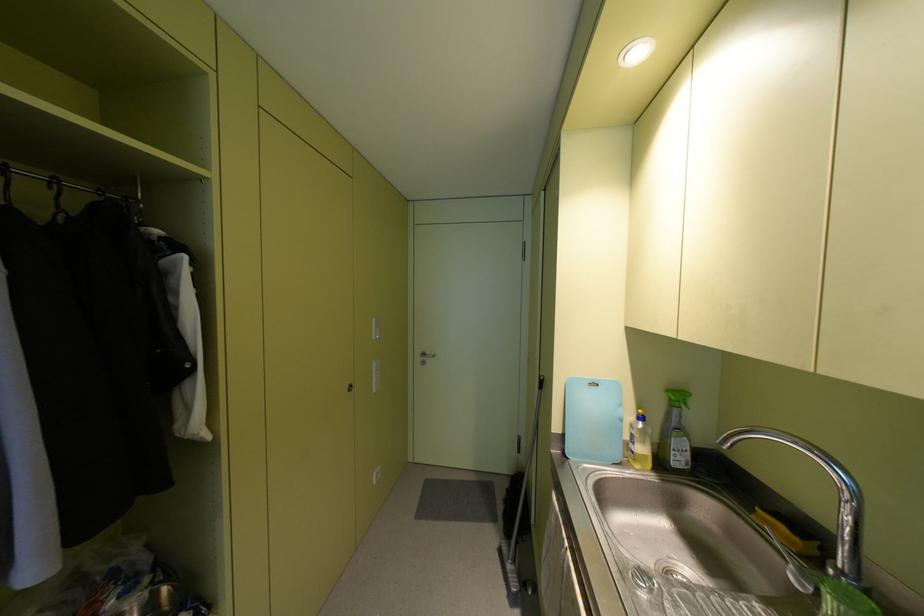
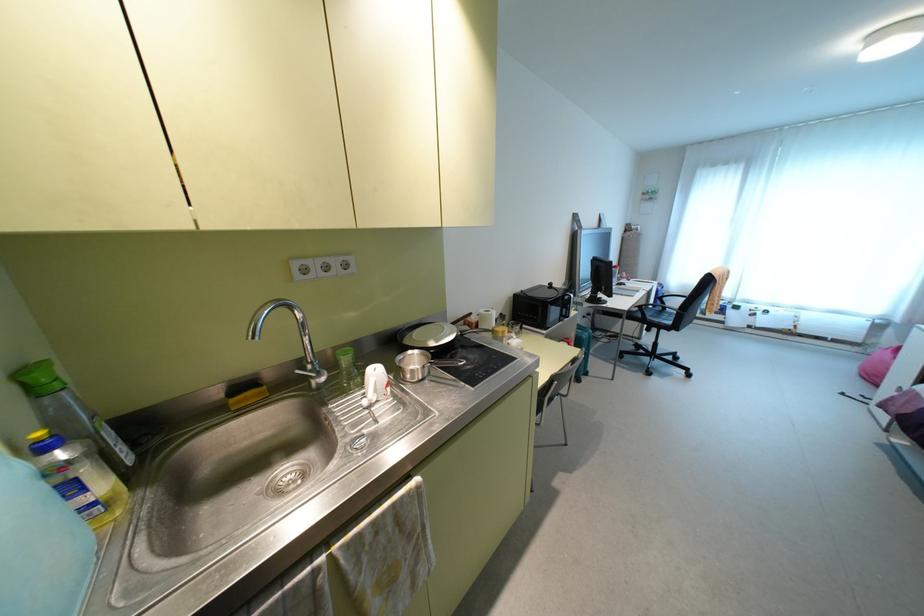
Where in the second image is the point corresponding to (x=640, y=416) from the first image?

(43, 447)